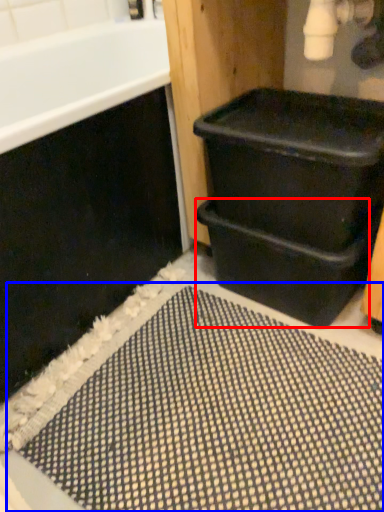
Question: Which object is further to the camera taking this photo, drawer (highlighted by a red box) or bath mat (highlighted by a blue box)?

Choices:
 (A) drawer
 (B) bath mat

Answer: (A)